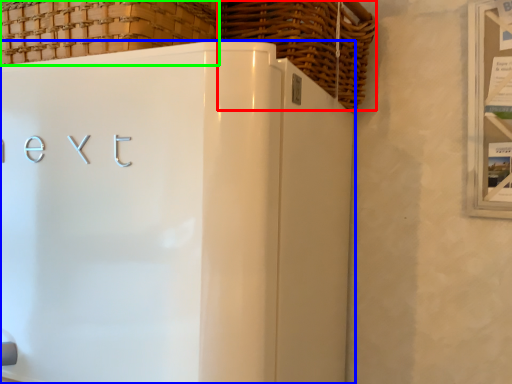
Question: Considering the real-world distances, which object is farthest from basket (highlighted by a red box)? refrigerator (highlighted by a blue box) or basket (highlighted by a green box)?

Choices:
 (A) refrigerator
 (B) basket

Answer: (A)